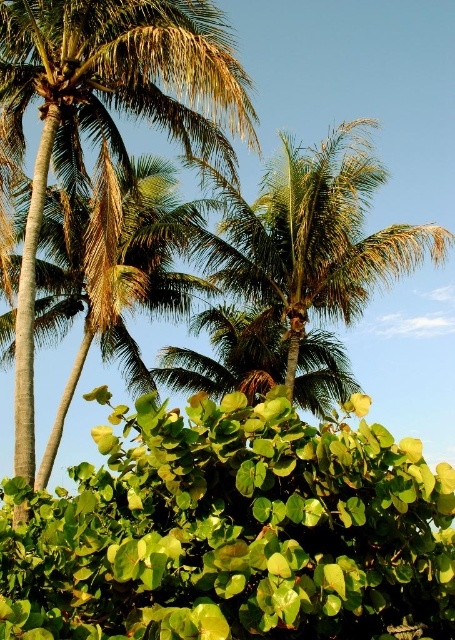
Locate an element on the screen. The image size is (455, 640). green leafy palm at center is located at coordinates (297, 269).

Who is more forward, (287, 380) or (134, 237)?

Point (287, 380) is more forward.

Is point (276, 346) less distant than point (140, 196)?

That is False.

Where is `green leafy palm at center`? The height and width of the screenshot is (640, 455). green leafy palm at center is located at coordinates (297, 269).